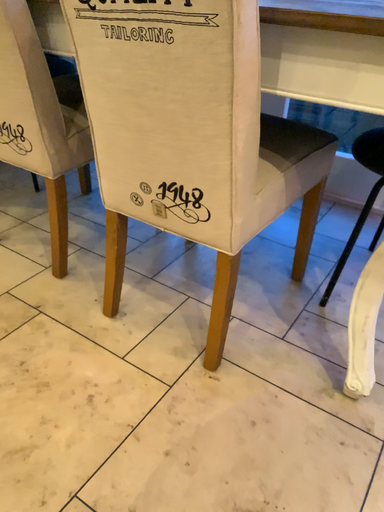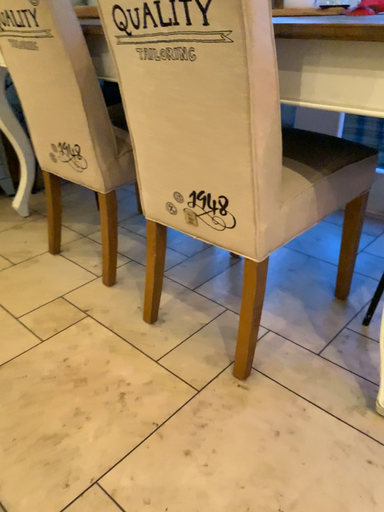
Question: How did the camera likely rotate when shooting the video?

Choices:
 (A) rotated right
 (B) rotated left

Answer: (B)